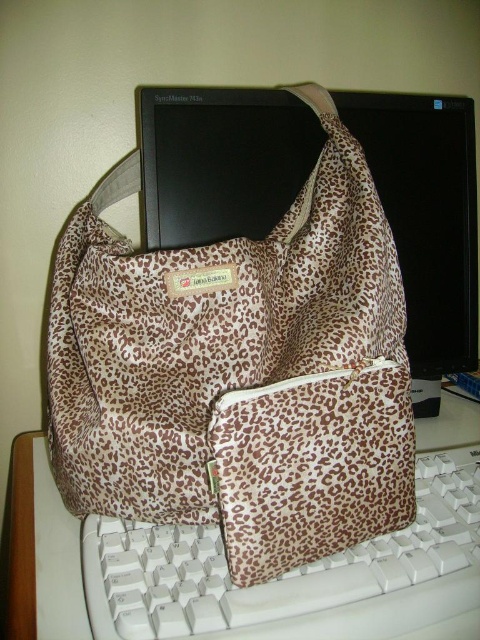
You are setting up your home office and want to ensure that your desk setup is ergonomic. You have a black glossy monitor at upper center and a white plastic keyboard at lower center. Which object should you adjust first to improve ergonomics, considering their heights?

The black glossy monitor at upper center is taller than the white plastic keyboard at lower center. To improve ergonomics, you should adjust the black glossy monitor at upper center first to ensure its height aligns with your eye level, promoting a comfortable posture.

You are organizing a desk and need to place the leopard print fabric bag at center and the white plastic keyboard at lower center. According to the scene, which object is taller?

The leopard print fabric bag at center is taller than the white plastic keyboard at lower center.

You need to place a new keyboard on the desk where the leopard print fabric bag at center and the black glossy monitor at upper center are located. Given the current arrangement, can the keyboard fit between them without overlapping either object?

The leopard print fabric bag at center has a lesser width compared to black glossy monitor at upper center. Since the bag is narrower, there might be enough space between them for the keyboard, but it depends on the exact dimensions of the keyboard and the distance between the two objects.